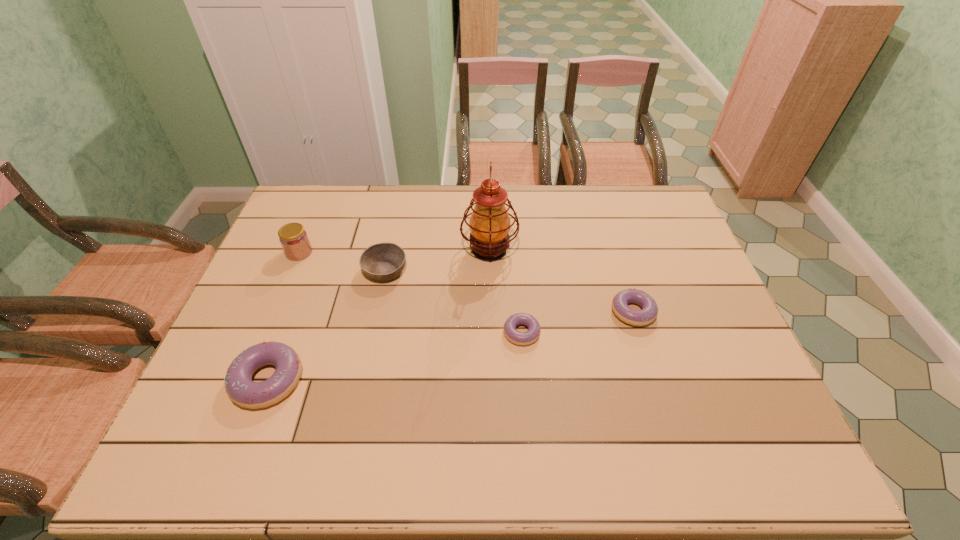
Please point a location where one more doughnut can be added evenly. Please provide its 2D coordinates. Your answer should be formatted as a tuple, i.e. [(x, y)], where the tuple contains the x and y coordinates of a point satisfying the conditions above.

[(400, 355)]